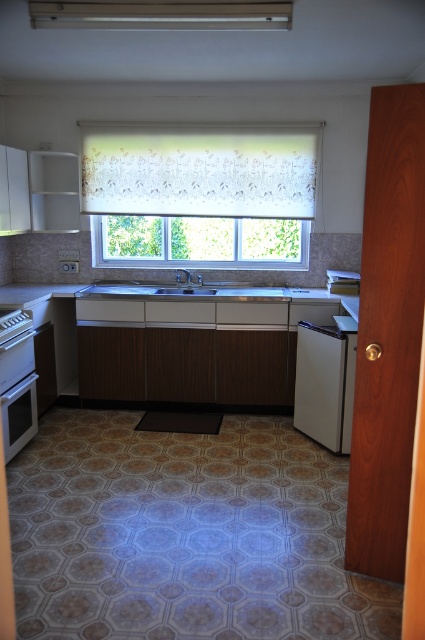
You are a chef preparing a dish and need to move ingredients from the white glossy counter top at center to the satin silver sink at center. Which direction should you move the ingredients to transfer them?

The white glossy counter top at center is below the satin silver sink at center, so you should move the ingredients upward to transfer them into the sink.

You are a delivery person who needs to place a new matte silver oven at left in the kitchen. The kitchen has a coordinate system where the bottom left corner is the origin point. Where should you place the oven?

The matte silver oven at left should be placed at the coordinate point of (17,381).

Looking at this image, you are a kitchen designer assessing the layout of the kitchen shown. You need to install a new microwave that requires a cabinet space taller than 60 cm. The matte silver oven at left and the satin silver sink at center are both candidates. Which one has sufficient height for the microwave?

The matte silver oven at left is much taller than the satin silver sink at center, so the matte silver oven at left has sufficient height for the microwave.